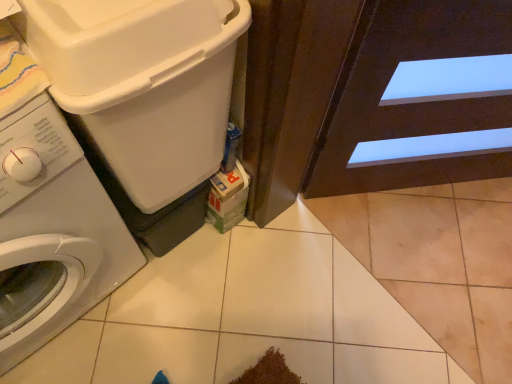
In order to face white glossy washing machine at left, which is the second washing machine in right-to-left order, should I rotate leftwards or rightwards?

Turn left approximately 33.127 degrees to face it.

Describe the element at coordinates (53, 232) in the screenshot. I see `white glossy washing machine at left, placed as the 1th washing machine when sorted from left to right` at that location.

Find the location of `white glossy washing machine at left, which is the second washing machine in right-to-left order`. white glossy washing machine at left, which is the second washing machine in right-to-left order is located at coordinates (53, 232).

What is the approximate height of white plastic washing machine at left, the 2th washing machine when ordered from left to right?

The height of white plastic washing machine at left, the 2th washing machine when ordered from left to right, is 22.97 inches.

Where is `white plastic washing machine at left, the 2th washing machine when ordered from left to right`? The height and width of the screenshot is (384, 512). white plastic washing machine at left, the 2th washing machine when ordered from left to right is located at coordinates (143, 98).

Describe the element at coordinates (143, 98) in the screenshot. This screenshot has width=512, height=384. I see `white plastic washing machine at left, the 1th washing machine viewed from the right` at that location.

Identify the location of white glossy washing machine at left, placed as the 1th washing machine when sorted from left to right. (53, 232).

Considering the positions of objects white plastic washing machine at left, the 1th washing machine viewed from the right, and white glossy washing machine at left, which is the second washing machine in right-to-left order, in the image provided, who is more to the left, white plastic washing machine at left, the 1th washing machine viewed from the right, or white glossy washing machine at left, which is the second washing machine in right-to-left order,?

white glossy washing machine at left, which is the second washing machine in right-to-left order, is more to the left.

Between white plastic washing machine at left, the 2th washing machine when ordered from left to right, and white glossy washing machine at left, which is the second washing machine in right-to-left order, which one is positioned in front?

white glossy washing machine at left, which is the second washing machine in right-to-left order, is in front.

Does point (71, 80) lie in front of point (21, 285)?

Yes, point (71, 80) is in front of point (21, 285).

From the image's perspective, relative to white glossy washing machine at left, which is the second washing machine in right-to-left order, is white plastic washing machine at left, the 2th washing machine when ordered from left to right, above or below?

white plastic washing machine at left, the 2th washing machine when ordered from left to right, is above white glossy washing machine at left, which is the second washing machine in right-to-left order.

From a real-world perspective, who is located higher, white plastic washing machine at left, the 1th washing machine viewed from the right, or white glossy washing machine at left, placed as the 1th washing machine when sorted from left to right?

white plastic washing machine at left, the 1th washing machine viewed from the right, from a real-world perspective.

Can you confirm if white plastic washing machine at left, the 1th washing machine viewed from the right, is wider than white glossy washing machine at left, placed as the 1th washing machine when sorted from left to right?

In fact, white plastic washing machine at left, the 1th washing machine viewed from the right, might be narrower than white glossy washing machine at left, placed as the 1th washing machine when sorted from left to right.

Between white plastic washing machine at left, the 1th washing machine viewed from the right, and white glossy washing machine at left, which is the second washing machine in right-to-left order, which one has more height?

With more height is white glossy washing machine at left, which is the second washing machine in right-to-left order.

Considering the relative sizes of white plastic washing machine at left, the 1th washing machine viewed from the right, and white glossy washing machine at left, which is the second washing machine in right-to-left order, in the image provided, is white plastic washing machine at left, the 1th washing machine viewed from the right, bigger than white glossy washing machine at left, which is the second washing machine in right-to-left order,?

Actually, white plastic washing machine at left, the 1th washing machine viewed from the right, might be smaller than white glossy washing machine at left, which is the second washing machine in right-to-left order.

Can white glossy washing machine at left, placed as the 1th washing machine when sorted from left to right, be found inside white plastic washing machine at left, the 1th washing machine viewed from the right?

No, white glossy washing machine at left, placed as the 1th washing machine when sorted from left to right, is located outside of white plastic washing machine at left, the 1th washing machine viewed from the right.

Is white plastic washing machine at left, the 2th washing machine when ordered from left to right, not near white glossy washing machine at left, placed as the 1th washing machine when sorted from left to right?

white plastic washing machine at left, the 2th washing machine when ordered from left to right, is actually quite close to white glossy washing machine at left, placed as the 1th washing machine when sorted from left to right.

Is white plastic washing machine at left, the 2th washing machine when ordered from left to right, looking in the opposite direction of white glossy washing machine at left, placed as the 1th washing machine when sorted from left to right?

No, white plastic washing machine at left, the 2th washing machine when ordered from left to right, is not facing the opposite direction of white glossy washing machine at left, placed as the 1th washing machine when sorted from left to right.

You are a GUI agent. You are given a task and a screenshot of the screen. Output one action in this format:
    pyautogui.click(x=<x>, y=<y>)
    Task: Click on the washing machine on the right of white glossy washing machine at left, placed as the 1th washing machine when sorted from left to right
    This screenshot has height=384, width=512.
    Given the screenshot: What is the action you would take?
    pyautogui.click(x=143, y=98)

Is white glossy washing machine at left, which is the second washing machine in right-to-left order, to the right of white plastic washing machine at left, the 1th washing machine viewed from the right, from the viewer's perspective?

No.

Does white glossy washing machine at left, placed as the 1th washing machine when sorted from left to right, come in front of white plastic washing machine at left, the 2th washing machine when ordered from left to right?

Yes, it is in front of white plastic washing machine at left, the 2th washing machine when ordered from left to right.

Which is in front, point (32, 156) or point (66, 3)?

The point (66, 3) is more forward.

From the image's perspective, is white glossy washing machine at left, placed as the 1th washing machine when sorted from left to right, located above or below white plastic washing machine at left, the 1th washing machine viewed from the right?

white glossy washing machine at left, placed as the 1th washing machine when sorted from left to right, is situated lower than white plastic washing machine at left, the 1th washing machine viewed from the right, in the image.

From a real-world perspective, which object rests below the other?

white glossy washing machine at left, which is the second washing machine in right-to-left order.

In the scene shown: Considering the relative sizes of white glossy washing machine at left, which is the second washing machine in right-to-left order, and white plastic washing machine at left, the 1th washing machine viewed from the right, in the image provided, is white glossy washing machine at left, which is the second washing machine in right-to-left order, thinner than white plastic washing machine at left, the 1th washing machine viewed from the right,?

In fact, white glossy washing machine at left, which is the second washing machine in right-to-left order, might be wider than white plastic washing machine at left, the 1th washing machine viewed from the right.

Who is taller, white glossy washing machine at left, which is the second washing machine in right-to-left order, or white plastic washing machine at left, the 2th washing machine when ordered from left to right?

Standing taller between the two is white glossy washing machine at left, which is the second washing machine in right-to-left order.

Considering the sizes of objects white glossy washing machine at left, which is the second washing machine in right-to-left order, and white plastic washing machine at left, the 2th washing machine when ordered from left to right, in the image provided, who is smaller, white glossy washing machine at left, which is the second washing machine in right-to-left order, or white plastic washing machine at left, the 2th washing machine when ordered from left to right,?

white plastic washing machine at left, the 2th washing machine when ordered from left to right.

Is white plastic washing machine at left, the 2th washing machine when ordered from left to right, a part of white glossy washing machine at left, placed as the 1th washing machine when sorted from left to right?

No, white plastic washing machine at left, the 2th washing machine when ordered from left to right, is not surrounded by white glossy washing machine at left, placed as the 1th washing machine when sorted from left to right.

Are white glossy washing machine at left, placed as the 1th washing machine when sorted from left to right, and white plastic washing machine at left, the 1th washing machine viewed from the right, far apart?

No, there isn't a large distance between white glossy washing machine at left, placed as the 1th washing machine when sorted from left to right, and white plastic washing machine at left, the 1th washing machine viewed from the right.

Is white glossy washing machine at left, which is the second washing machine in right-to-left order, facing away from white plastic washing machine at left, the 1th washing machine viewed from the right?

No, white plastic washing machine at left, the 1th washing machine viewed from the right, is not at the back of white glossy washing machine at left, which is the second washing machine in right-to-left order.

How different are the orientations of white glossy washing machine at left, placed as the 1th washing machine when sorted from left to right, and white plastic washing machine at left, the 1th washing machine viewed from the right, in degrees?

The facing directions of white glossy washing machine at left, placed as the 1th washing machine when sorted from left to right, and white plastic washing machine at left, the 1th washing machine viewed from the right, are 1.89 degrees apart.

Find the location of a particular element. This screenshot has height=384, width=512. washing machine on the left of white plastic washing machine at left, the 2th washing machine when ordered from left to right is located at coordinates (53, 232).

You are a GUI agent. You are given a task and a screenshot of the screen. Output one action in this format:
    pyautogui.click(x=<x>, y=<y>)
    Task: Click on the washing machine below the white plastic washing machine at left, the 1th washing machine viewed from the right (from a real-world perspective)
    This screenshot has height=384, width=512.
    Given the screenshot: What is the action you would take?
    pyautogui.click(x=53, y=232)

This screenshot has width=512, height=384. I want to click on washing machine that is in front of the white plastic washing machine at left, the 1th washing machine viewed from the right, so click(x=53, y=232).